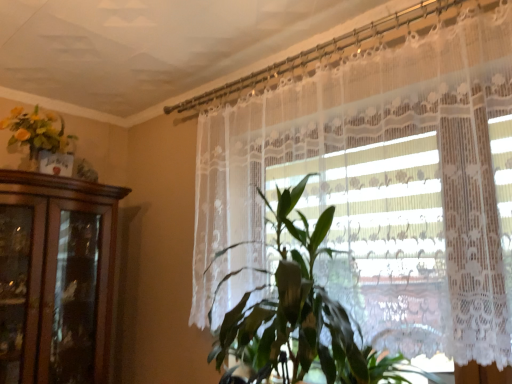
Question: Is green leafy plant at center further to camera compared to white lace curtain at center?

Choices:
 (A) no
 (B) yes

Answer: (A)

Question: From a real-world perspective, is green leafy plant at center positioned under white lace curtain at center based on gravity?

Choices:
 (A) no
 (B) yes

Answer: (B)

Question: Considering the relative positions of green leafy plant at center and white lace curtain at center in the image provided, is green leafy plant at center to the right of white lace curtain at center from the viewer's perspective?

Choices:
 (A) no
 (B) yes

Answer: (A)

Question: Does green leafy plant at center have a greater height compared to white lace curtain at center?

Choices:
 (A) no
 (B) yes

Answer: (A)

Question: From the image's perspective, is green leafy plant at center located beneath white lace curtain at center?

Choices:
 (A) yes
 (B) no

Answer: (A)

Question: Looking at the image, does green leafy plant at center seem bigger or smaller compared to white lace curtain at center?

Choices:
 (A) small
 (B) big

Answer: (A)

Question: From a real-world perspective, relative to white lace curtain at center, is green leafy plant at center vertically above or below?

Choices:
 (A) above
 (B) below

Answer: (B)

Question: From their relative heights in the image, would you say green leafy plant at center is taller or shorter than white lace curtain at center?

Choices:
 (A) short
 (B) tall

Answer: (A)

Question: Looking at their shapes, would you say green leafy plant at center is wider or thinner than white lace curtain at center?

Choices:
 (A) thin
 (B) wide

Answer: (B)

Question: Is matte yellow flowers at upper left in front of or behind green leafy plant at center in the image?

Choices:
 (A) behind
 (B) front

Answer: (A)

Question: From a real-world perspective, relative to green leafy plant at center, is matte yellow flowers at upper left vertically above or below?

Choices:
 (A) below
 (B) above

Answer: (B)

Question: Is point (29, 157) positioned closer to the camera than point (246, 314)?

Choices:
 (A) farther
 (B) closer

Answer: (A)

Question: Considering the positions of matte yellow flowers at upper left and green leafy plant at center in the image, is matte yellow flowers at upper left taller or shorter than green leafy plant at center?

Choices:
 (A) short
 (B) tall

Answer: (A)

Question: Is green leafy plant at center situated inside matte yellow flowers at upper left or outside?

Choices:
 (A) inside
 (B) outside

Answer: (B)

Question: Relative to matte yellow flowers at upper left, is green leafy plant at center in front or behind?

Choices:
 (A) front
 (B) behind

Answer: (A)